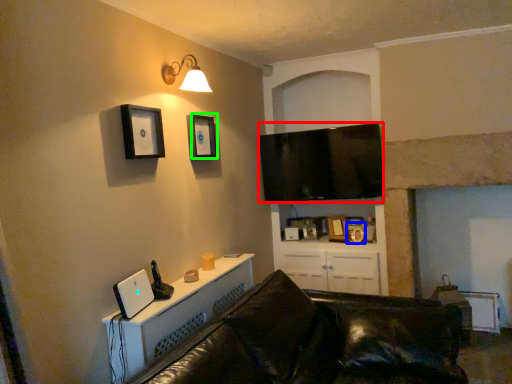
Question: Based on their relative distances, which object is farther from television (highlighted by a red box)? Choose from picture frame (highlighted by a blue box) and picture frame (highlighted by a green box).

Choices:
 (A) picture frame
 (B) picture frame

Answer: (B)